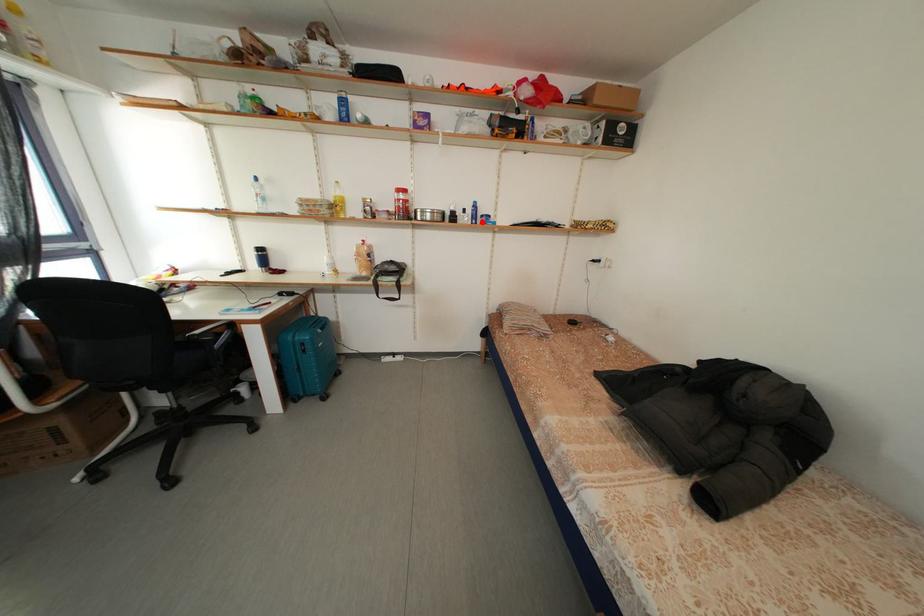
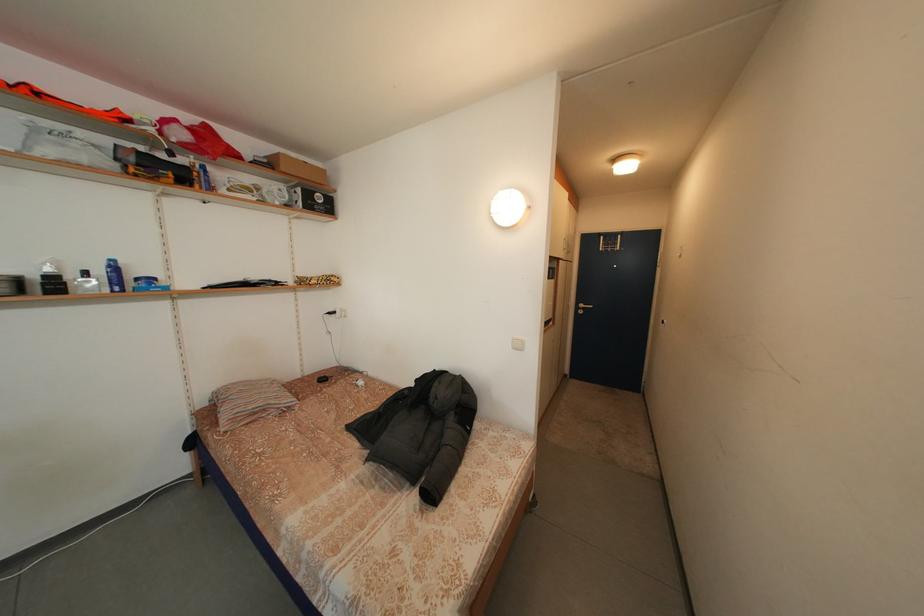
Question: I am providing you with two images of the same scene from different viewpoints. Given a red point in image1, look at the same physical point in image2. Is it:

Choices:
 (A) Closer to the viewpoint
 (B) Farther from the viewpoint

Answer: (B)